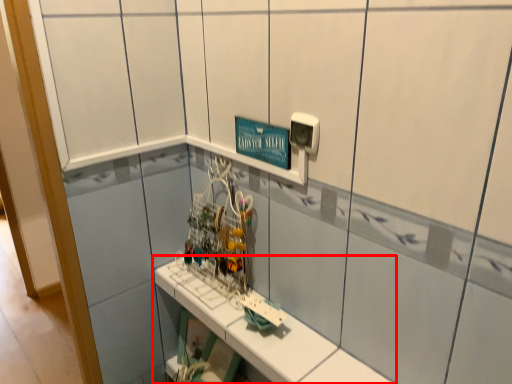
Question: From the image's perspective, where is shelf (annotated by the red box) located in relation to electric outlet in the image?

Choices:
 (A) above
 (B) below

Answer: (B)